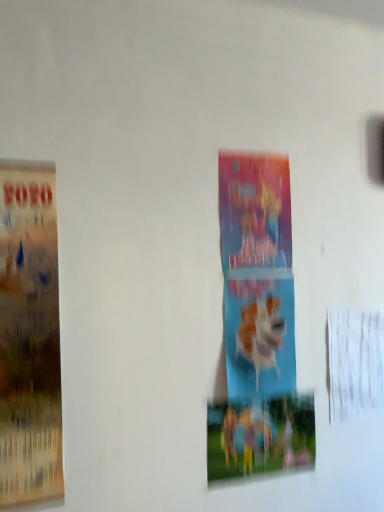
Question: Considering their positions, is colorful paper poster at center, which appears as the second poster when viewed from the front, located in front of or behind matte paper poster at left, which is the second poster from right to left?

Choices:
 (A) behind
 (B) front

Answer: (A)

Question: Looking at their shapes, would you say colorful paper poster at center, marked as the 2th poster in a left-to-right arrangement, is wider or thinner than matte paper poster at left, which is the second poster from right to left?

Choices:
 (A) wide
 (B) thin

Answer: (B)

Question: Considering the real-world distances, which object is farthest from the blue matte dog at center?

Choices:
 (A) matte paper poster at left, which appears as the 1th poster when viewed from the front
 (B) colorful paper poster at center, which is the 1th poster in back-to-front order

Answer: (A)

Question: Estimate the real-world distances between objects in this image. Which object is farther from the matte paper poster at left, which appears as the 1th poster when viewed from the front?

Choices:
 (A) blue matte dog at center
 (B) colorful paper poster at center, which is the 1th poster in back-to-front order

Answer: (A)